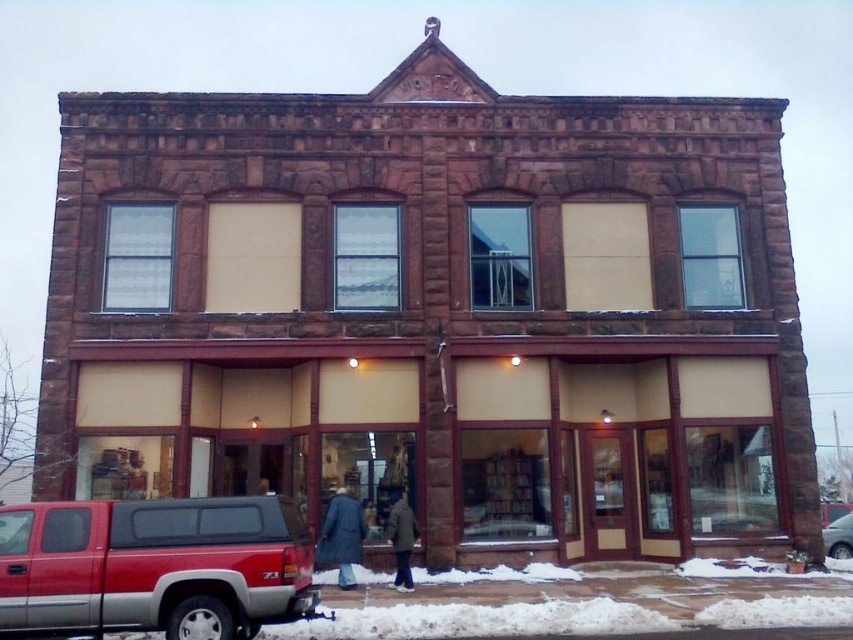
You are a delivery person who needs to park your red metallic pickup truck at lower left as close as possible to the dark blue coat at center without blocking the entrance. Based on their positions, can you park the truck to the immediate left of the coat?

Yes, the red metallic pickup truck at lower left can be parked to the immediate left of the dark blue coat at center since it is already positioned to the left of it.

You are a delivery person trying to park your red metallic pickup truck at lower left in a parking spot that can only accommodate vehicles narrower than the dark blue coat at center. Can your truck fit?

The red metallic pickup truck at lower left might be wider than dark blue coat at center, so it may not fit in the parking spot.

You are standing in front of the two story brick building and see two coats hanging at the center. Which coat is closer to you, the dark blue coat at center or the dark brown leather coat at center?

The dark blue coat at center is closer to you because the dark brown leather coat at center is behind it.